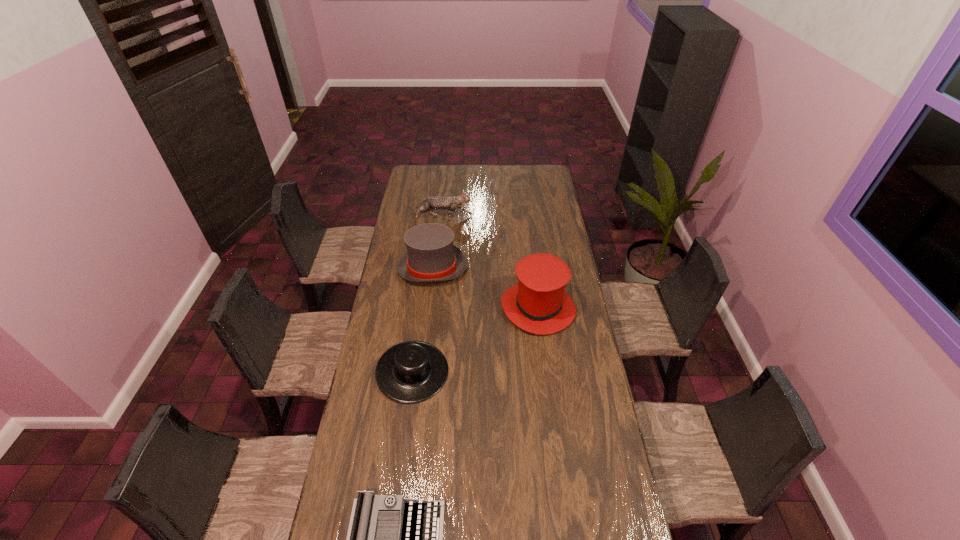
I want to click on object that is the third nearest to the rightmost dress hat, so click(433, 202).

Choose which object is the third nearest neighbor to the cat. Please provide its 2D coordinates. Your answer should be formatted as a tuple, i.e. [(x, y)], where the tuple contains the x and y coordinates of a point satisfying the conditions above.

[(413, 371)]

Locate an element on the screen. This screenshot has width=960, height=540. the second closest dress hat to the third tallest object is located at coordinates (539, 304).

Choose which dress hat is the nearest neighbor to the rightmost object. Please provide its 2D coordinates. Your answer should be formatted as a tuple, i.e. [(x, y)], where the tuple contains the x and y coordinates of a point satisfying the conditions above.

[(431, 256)]

Where is `free spot that satisfies the following two spatial constraints: 1. on the face of the third shortest object; 2. on the left side of the rightmost dress hat`? The width and height of the screenshot is (960, 540). free spot that satisfies the following two spatial constraints: 1. on the face of the third shortest object; 2. on the left side of the rightmost dress hat is located at coordinates (431, 307).